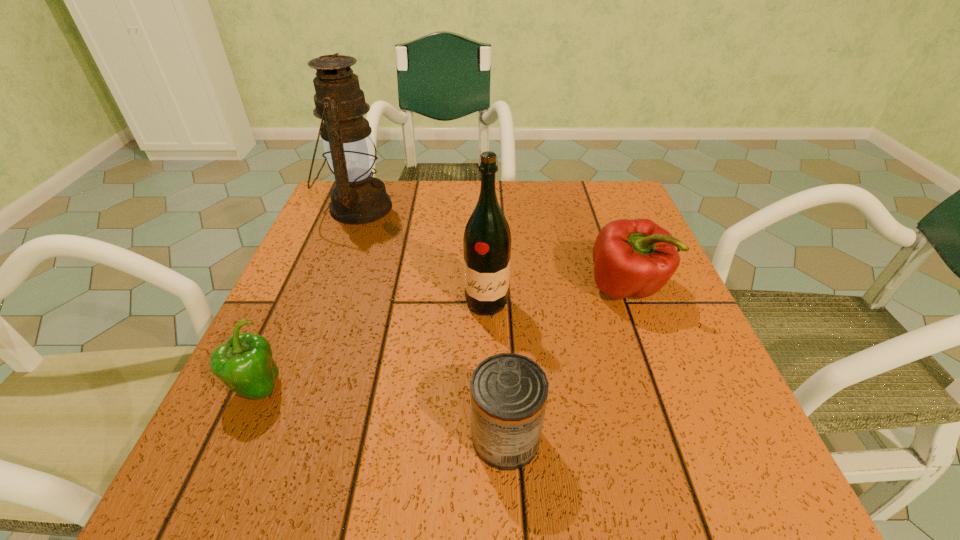
Identify the location of object that is the third nearest to the can. (244, 364).

Where is `vacant area in the image that satisfies the following two spatial constraints: 1. on the front side of the can; 2. on the right side of the left bell pepper`? The width and height of the screenshot is (960, 540). vacant area in the image that satisfies the following two spatial constraints: 1. on the front side of the can; 2. on the right side of the left bell pepper is located at coordinates (235, 437).

The width and height of the screenshot is (960, 540). Identify the location of free space that satisfies the following two spatial constraints: 1. on the front-facing side of the second tallest object; 2. on the right side of the can. (489, 437).